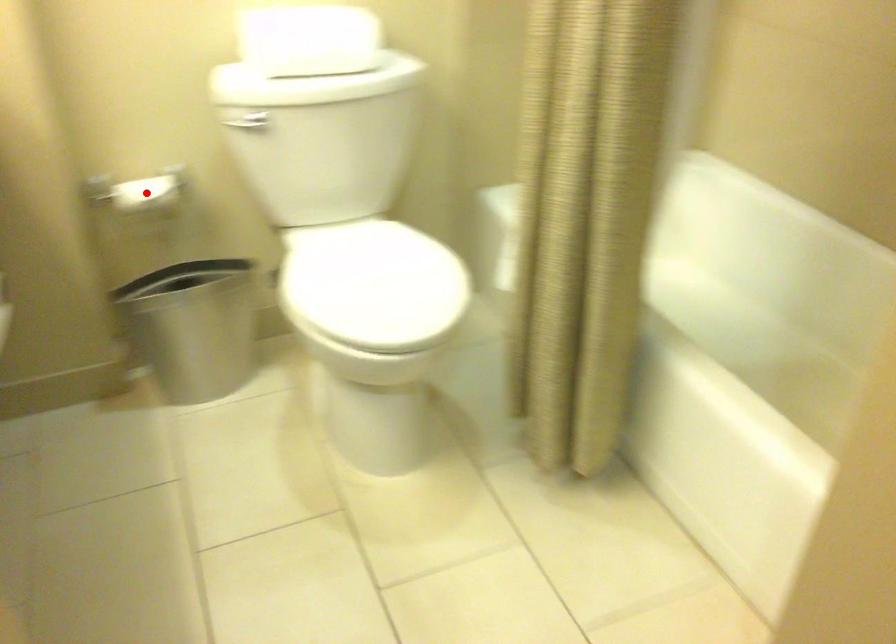
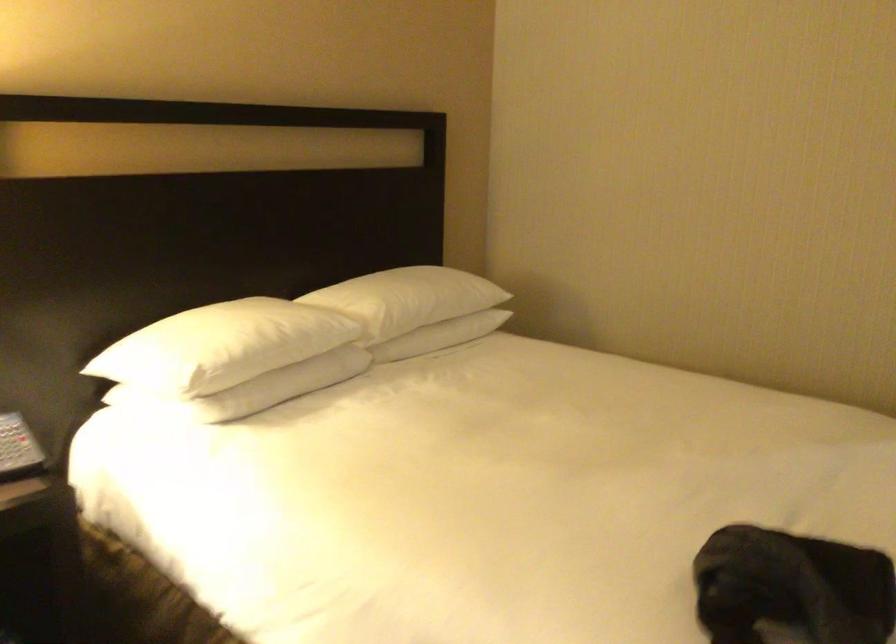
Question: I am providing you with two images of the same scene from different viewpoints. A red point is marked on the first image. Can you still see the location of the red point in image 2?

Choices:
 (A) Yes
 (B) No

Answer: (B)